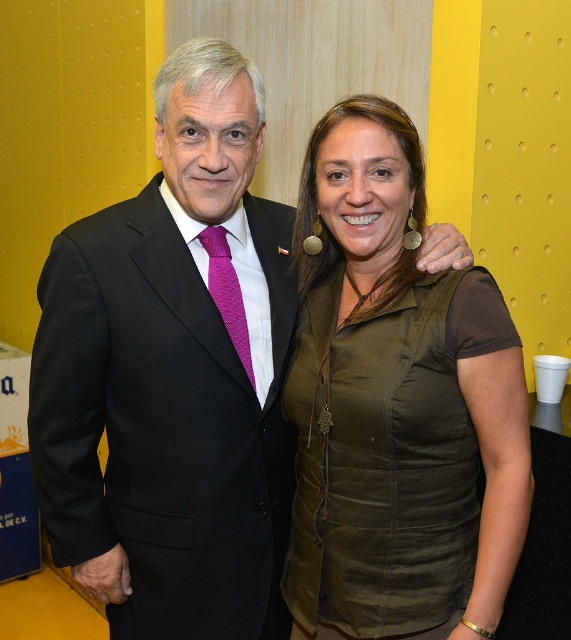
Question: Does green textured vest at center have a smaller size compared to black wool suit at center?

Choices:
 (A) yes
 (B) no

Answer: (A)

Question: Which object is closer to the camera taking this photo?

Choices:
 (A) green textured vest at center
 (B) black wool suit at center

Answer: (A)

Question: Which point is farther from the camera taking this photo?

Choices:
 (A) (203, 545)
 (B) (239, 355)

Answer: (B)

Question: Which of the following is the farthest from the observer?

Choices:
 (A) (380, 384)
 (B) (210, 387)
 (C) (236, 326)

Answer: (C)

Question: Does green textured vest at center appear on the left side of black wool suit at center?

Choices:
 (A) yes
 (B) no

Answer: (B)

Question: Can you confirm if black wool suit at center is positioned above purple textured tie at center?

Choices:
 (A) no
 (B) yes

Answer: (A)